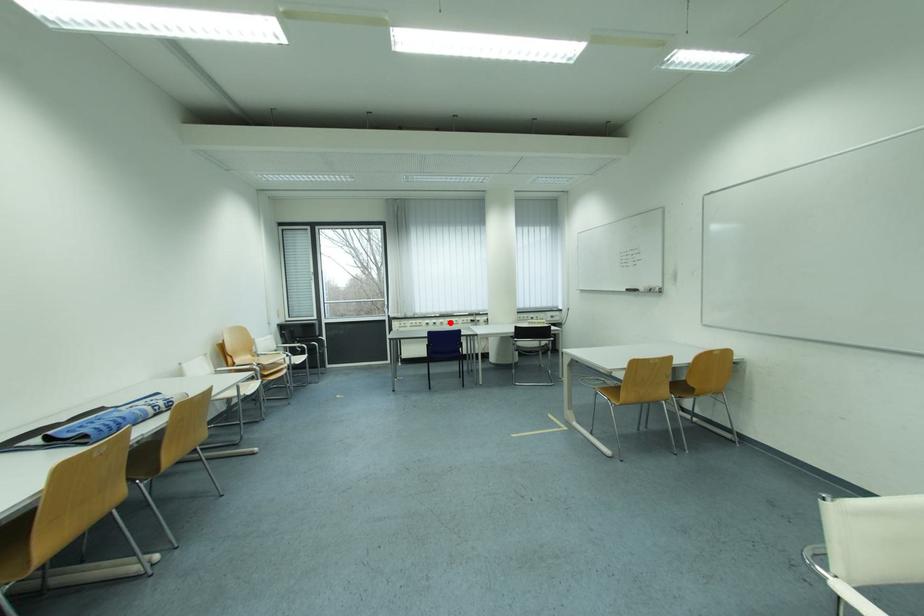
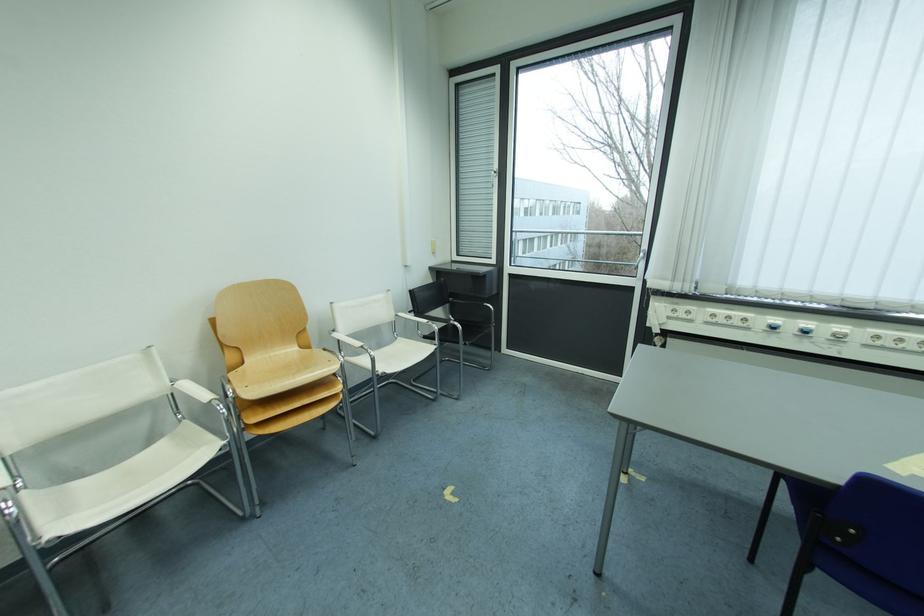
Locate, in the second image, the point that corresponds to the highlighted location in the first image.

(849, 330)